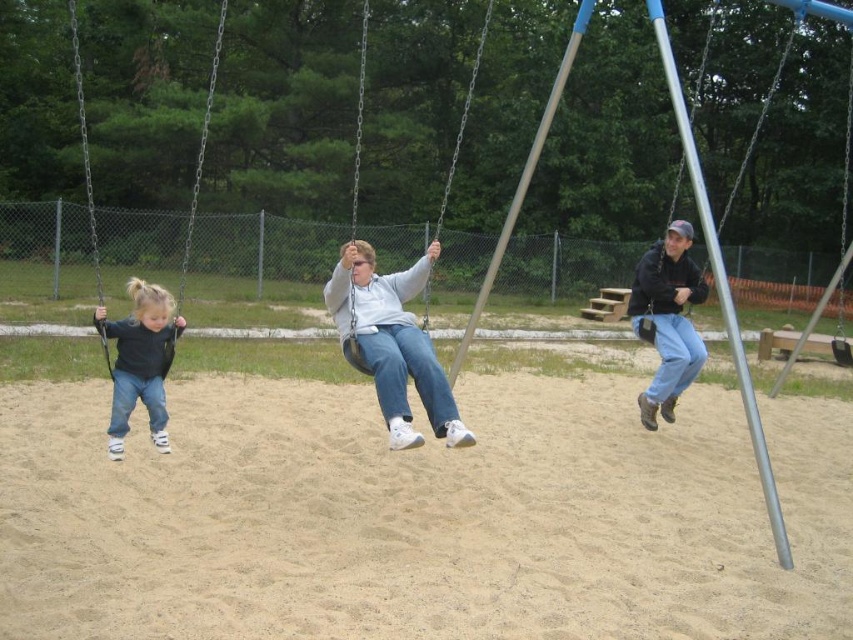
In the scene shown: You are standing at the playground and notice the black matte jacket at upper right and the matte black swing at left. Which object is closer to the ground?

The black matte jacket at upper right is positioned under the matte black swing at left, meaning the jacket is closer to the ground than the swing.

You are a parent trying to decide which swing to use. You have a black matte jacket at upper right and a matte black swing at left. Which one is wider?

The matte black swing at left is wider than the black matte jacket at upper right.

You are a parent at the playground observing your child. You notice the matte gray sweater at center and the metallic silver swing at center. Which object is closer to the ground?

The matte gray sweater at center is closer to the ground because it is shorter than the metallic silver swing at center.